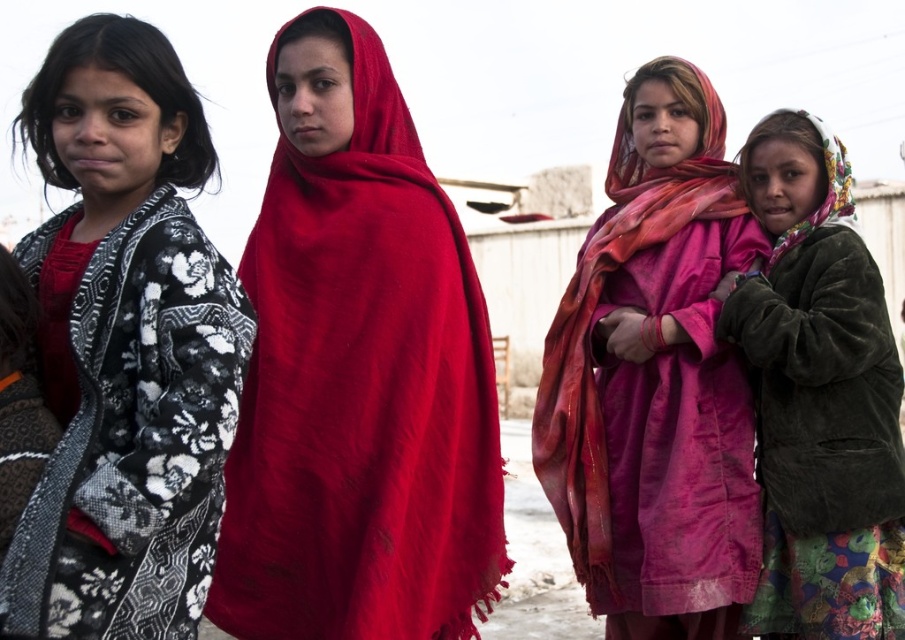
You are a photographer trying to capture a clear shot of both the black and white floral shawl at left and the velvet brown jacket at lower right. Which object should you focus on first to ensure both are in focus?

You should focus on the black and white floral shawl at left first because it is closer to the viewer than the velvet brown jacket at lower right. By focusing on the closer object, the farther one may still be within the depth of field, increasing the chances of both being in focus.

In the scene shown: You are a photographer trying to capture a group photo of the four girls. You need to ensure that the matte red shawl at center is visible in the frame. Based on its position, where should you position the camera relative to the girls?

The matte red shawl at center is located at point (362, 392), so you should position the camera to the left side of the group to ensure the shawl is visible in the frame.